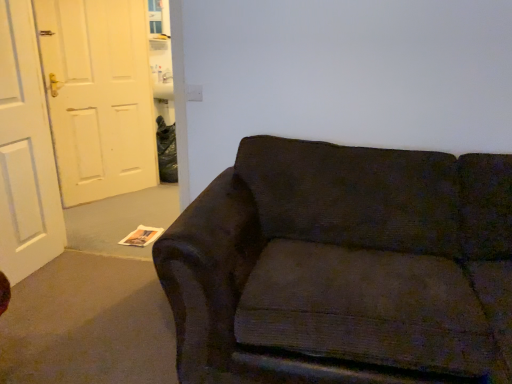
Question: From the image's perspective, relative to white matte door at left, arranged as the second door when viewed from the back, is white matte door at left, the 1th door positioned from the back, above or below?

Choices:
 (A) above
 (B) below

Answer: (A)

Question: Based on their positions, is white matte door at left, the 1th door positioned from the back, located to the left or right of white matte door at left, the first door in the front-to-back sequence?

Choices:
 (A) left
 (B) right

Answer: (B)

Question: Which is nearer to the dark fabric couch at center?

Choices:
 (A) white matte door at left, arranged as the second door when viewed from the back
 (B) white matte door at left, the 1th door positioned from the back

Answer: (A)

Question: Which is farther from the white matte door at left, the 1th door positioned from the back?

Choices:
 (A) white matte door at left, the first door in the front-to-back sequence
 (B) dark fabric couch at center

Answer: (B)